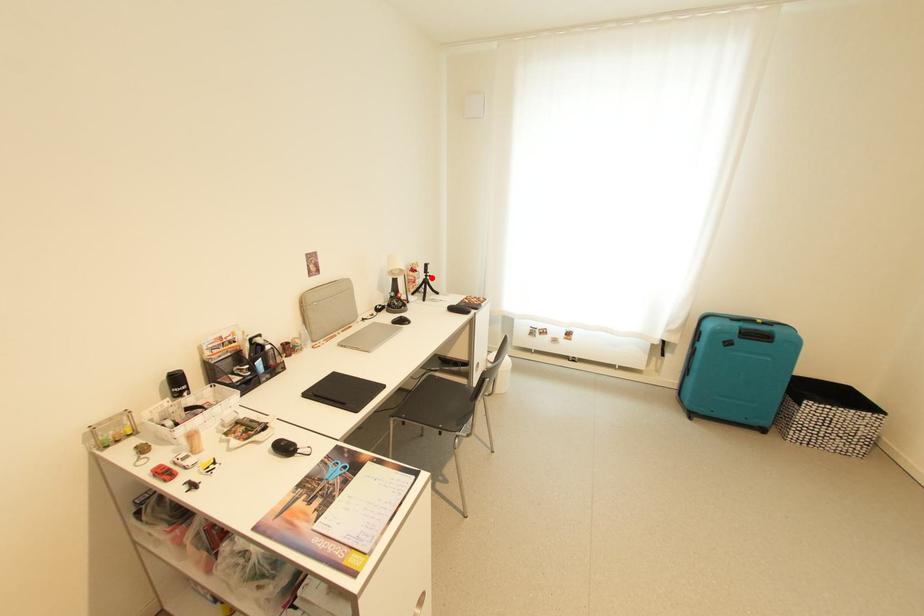
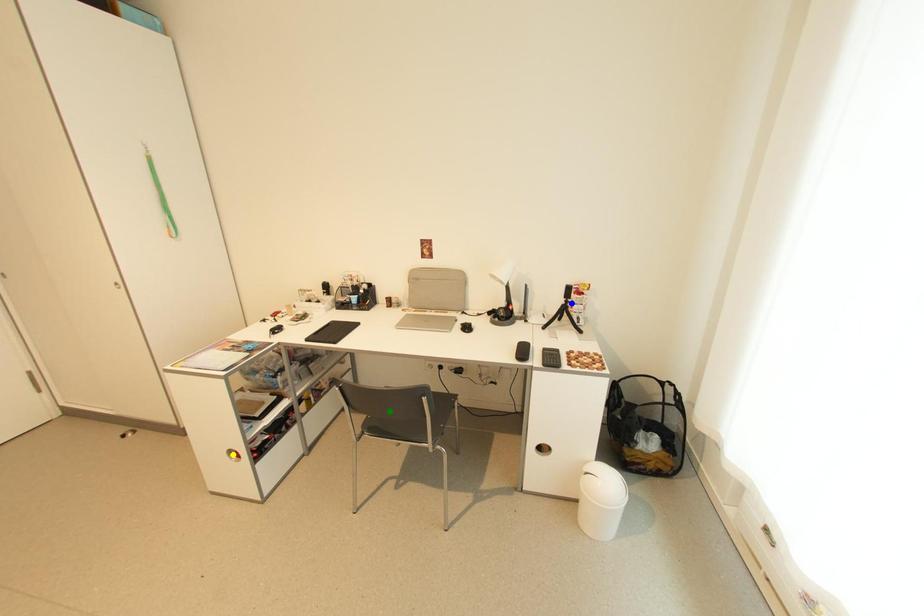
Question: I am providing you with two images of the same scene from different viewpoints. A red point is marked on the first image. You are given multiple points on the second image. Which spot in image 2 lines up with the point in image 1?

Choices:
 (A) yellow point
 (B) green point
 (C) blue point

Answer: (C)